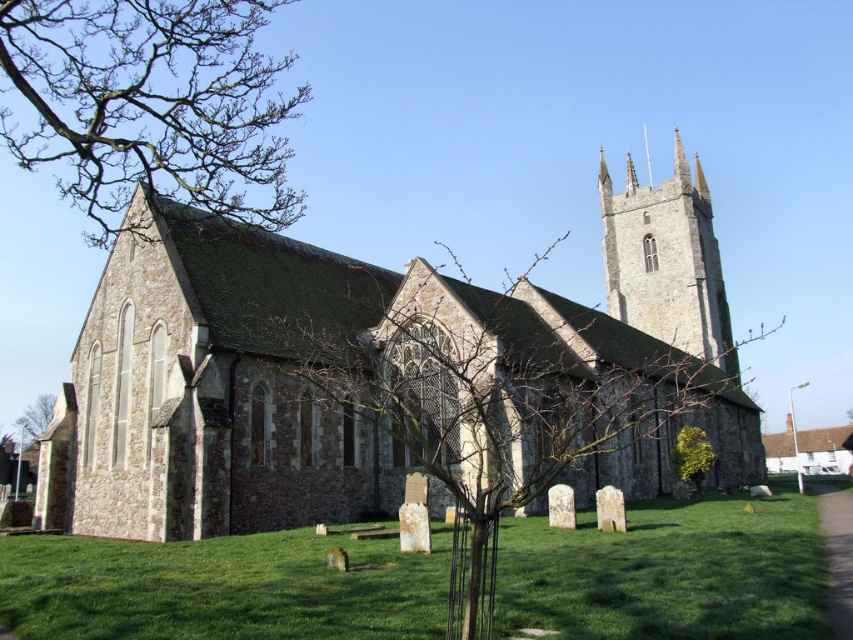
You are standing in front of the historic stone church and notice two distinct elements in the scene. You see a green leafy tree at center and a bare branches at upper left. Which of these two objects is positioned to the right side of the other?

The green leafy tree at center is positioned to the right of the bare branches at upper left.

You are standing in front of the historic stone church and notice two points marked in the image. From your perspective, which point is closer to you, point (434,332) or point (645,189)?

Point (434,332) is in front of point (645,189), so it is closer to you.